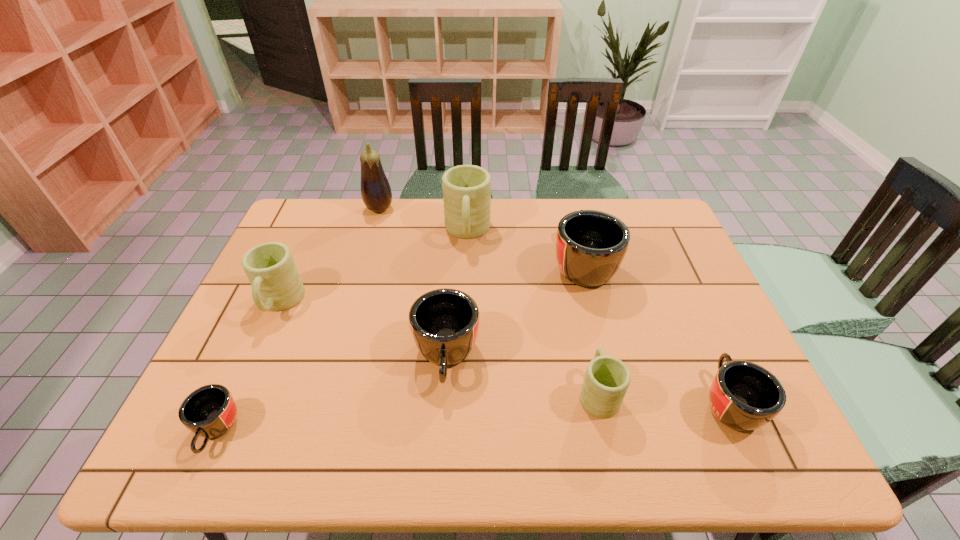
The height and width of the screenshot is (540, 960). Find the location of `blank area located 0.220m on the side of the leftmost green mug with the handle`. blank area located 0.220m on the side of the leftmost green mug with the handle is located at coordinates (235, 403).

Identify the location of vacant space located on the side of the second biggest red mug with the handle. The height and width of the screenshot is (540, 960). (439, 467).

You are a GUI agent. You are given a task and a screenshot of the screen. Output one action in this format:
    pyautogui.click(x=<x>, y=<y>)
    Task: Click on the vacant space situated 0.230m on the side of the rightmost green mug with the handle
    Image resolution: width=960 pixels, height=540 pixels.
    Given the screenshot: What is the action you would take?
    pyautogui.click(x=578, y=299)

Find the location of a particular element. vacant space located 0.230m on the side of the rightmost green mug with the handle is located at coordinates (578, 299).

The image size is (960, 540). I want to click on vacant space located 0.150m on the side of the rightmost green mug with the handle, so click(583, 321).

The image size is (960, 540). Find the location of `vacant area situated 0.400m on the side of the rightmost red mug with the handle`. vacant area situated 0.400m on the side of the rightmost red mug with the handle is located at coordinates click(x=664, y=260).

You are a GUI agent. You are given a task and a screenshot of the screen. Output one action in this format:
    pyautogui.click(x=<x>, y=<y>)
    Task: Click on the free space located on the side of the rightmost red mug with the handle
    The image size is (960, 540).
    Given the screenshot: What is the action you would take?
    pyautogui.click(x=664, y=260)

At what (x,y) coordinates should I click in order to perform the action: click on free space located on the side of the rightmost red mug with the handle. Please return your answer as a coordinate pair (x, y). Image resolution: width=960 pixels, height=540 pixels. Looking at the image, I should click on (667, 266).

This screenshot has height=540, width=960. What are the coordinates of `eggplant that is at the far edge` in the screenshot? It's located at (376, 193).

Find the location of a particular element. The width and height of the screenshot is (960, 540). object at the right edge is located at coordinates (744, 396).